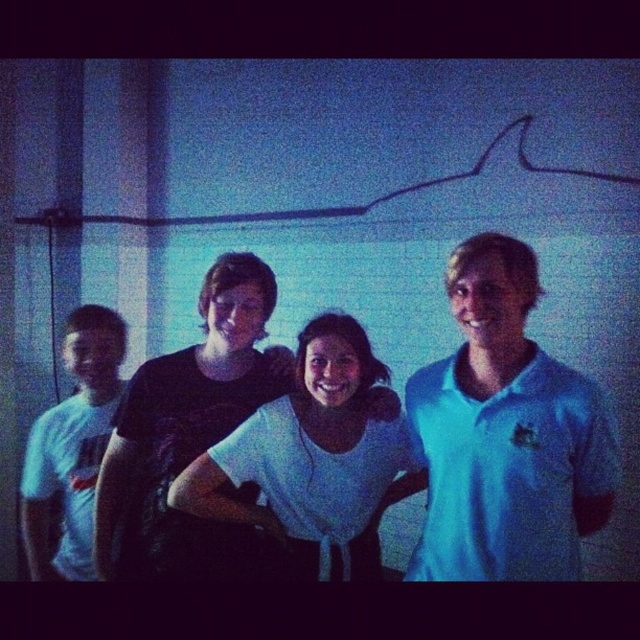
You are standing in front of the group of four people in the image. You notice two points marked in the scene. The first point is at coordinates point (285, 404) and the second is at point (54, 454). Which of these two points is nearer to you?

Point (285, 404) is closer to the viewer than point (54, 454).

You are standing in front of the group of four people in the image. You notice two points marked on the image at coordinates point (x=429, y=368) and point (x=106, y=372). Which point is nearer to you?

Point (x=429, y=368) is closer to the camera than point (x=106, y=372), so the point nearer to you is point (x=429, y=368).